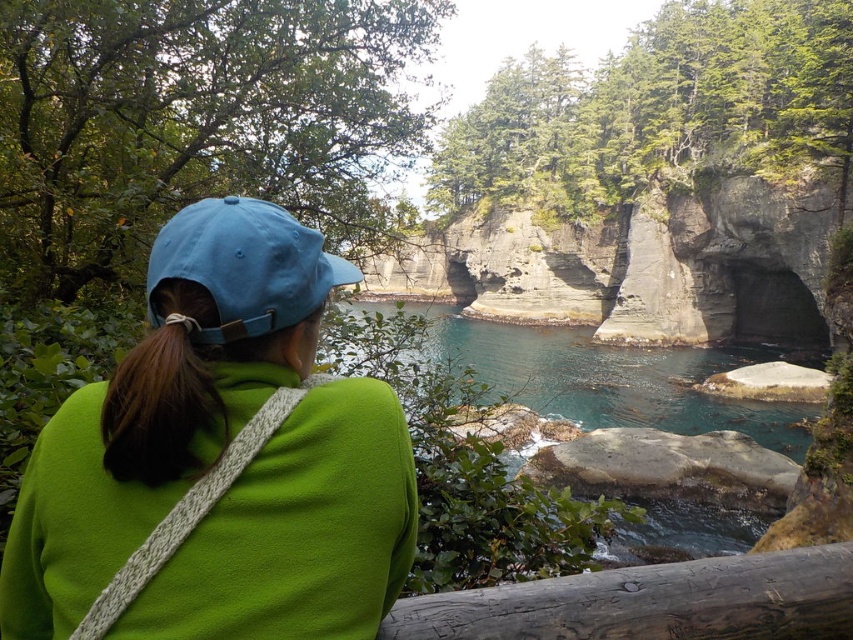
You are standing behind the person in the scene and want to know if the matte blue cap at upper left can be seen above the wooden rail at lower center. Based on their relative heights, what do you think?

The matte blue cap at upper left is taller than the wooden rail at lower center, so yes, the matte blue cap at upper left can be seen above the wooden rail at lower center.

You are standing behind the person in the scene and want to know if the wooden rail at lower center is taller than the blue fabric cap at upper left. Can you confirm this?

The wooden rail at lower center is much taller than the blue fabric cap at upper left, so yes, it is taller.

You are standing behind the person in the scene and want to place a small marker exactly where the blue fabric cap at upper left is located. According to the coordinates provided, where should you place the marker?

You should place the marker at the coordinates point (244,266) where the blue fabric cap at upper left is located.